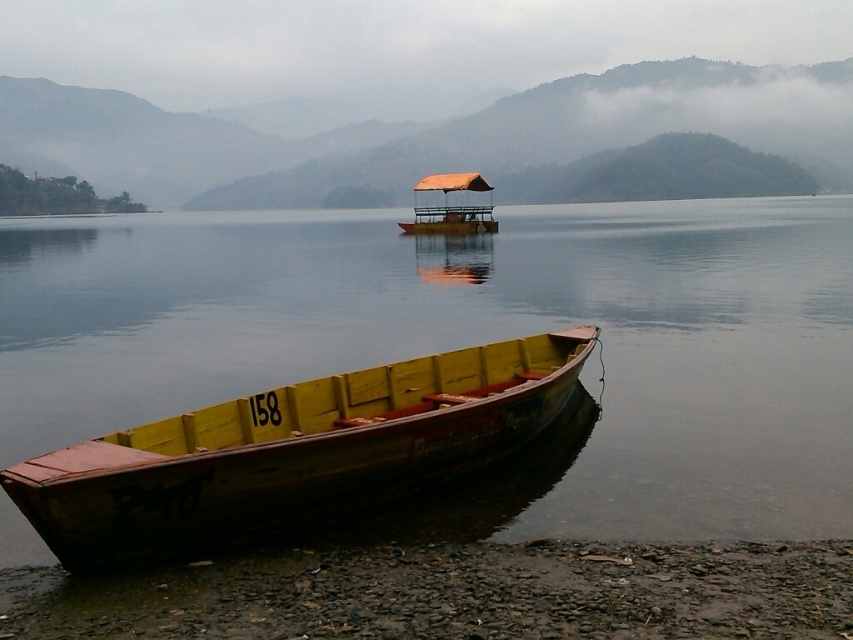
Question: Observing the image, what is the correct spatial positioning of yellow wood boat at lower left in reference to smooth pebbles at lower left?

Choices:
 (A) above
 (B) below

Answer: (A)

Question: Which point is closer to the camera?

Choices:
 (A) (648, 518)
 (B) (467, 184)

Answer: (A)

Question: Among these objects, which one is nearest to the camera?

Choices:
 (A) yellow wooden boat at lower left
 (B) orange fabric boat at center
 (C) yellow wood boat at lower left

Answer: (C)

Question: Is yellow wooden boat at lower left above orange fabric boat at center?

Choices:
 (A) no
 (B) yes

Answer: (A)

Question: Can you confirm if yellow wood boat at lower left is positioned below smooth pebbles at lower left?

Choices:
 (A) no
 (B) yes

Answer: (A)

Question: Among these points, which one is farthest from the camera?

Choices:
 (A) (351, 396)
 (B) (323, 573)

Answer: (A)